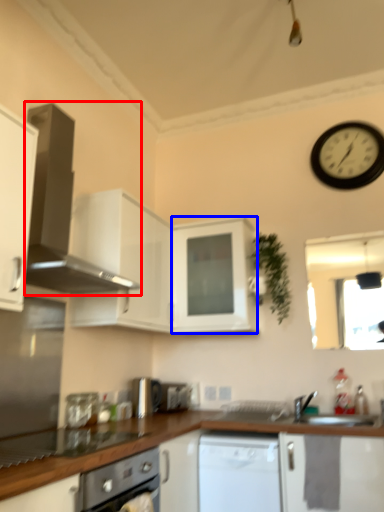
Question: Which object appears closest to the camera in this image, home appliance (highlighted by a red box) or cabinetry (highlighted by a blue box)?

Choices:
 (A) home appliance
 (B) cabinetry

Answer: (A)